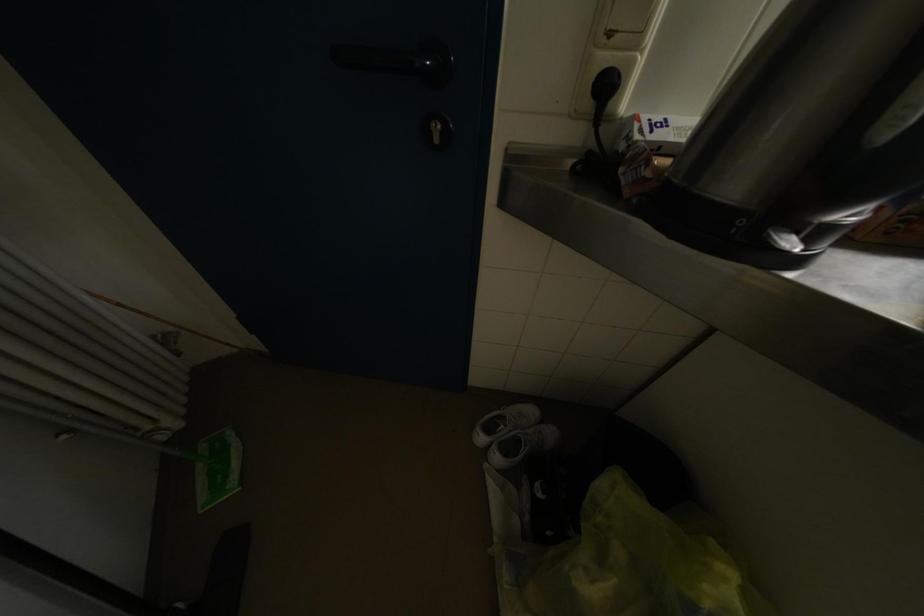
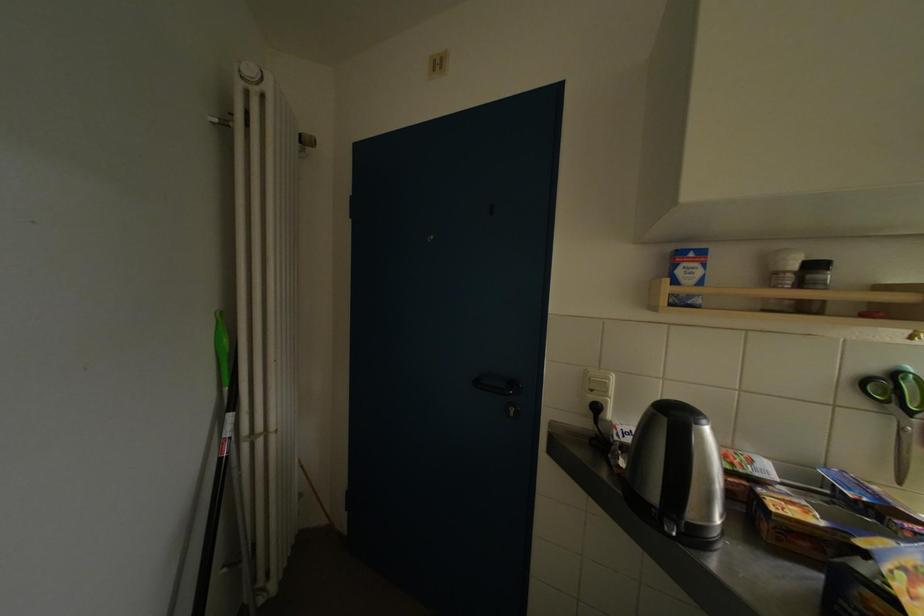
Locate, in the second image, the point that corresponds to [748,225] in the first image.

(661, 514)